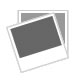
Locate an element on the screen. The image size is (80, 80). area to left of pictures is located at coordinates (4, 49).